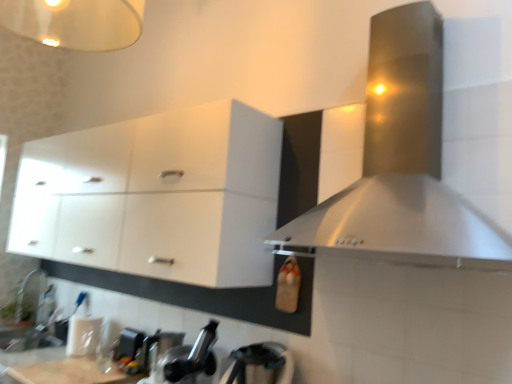
What is the approximate width of white glossy sink at lower left?

The width of white glossy sink at lower left is 13.00 inches.

Locate an element on the screen. This screenshot has height=384, width=512. metallic gray toaster at lower left, the third appliance when ordered from right to left is located at coordinates (x=129, y=343).

You are a GUI agent. You are given a task and a screenshot of the screen. Output one action in this format:
    pyautogui.click(x=<x>, y=<y>)
    Task: Click on the stainless steel range hood at upper right
    
    Given the screenshot: What is the action you would take?
    point(403,164)

Is point (169, 363) farther from viewer compared to point (45, 273)?

That is False.

Measure the distance between black matte faucet at lower center, acting as the second appliance starting from the right, and brushed metal faucet at lower left.

A distance of 5.90 feet exists between black matte faucet at lower center, acting as the second appliance starting from the right, and brushed metal faucet at lower left.

From a real-world perspective, does black matte faucet at lower center, acting as the second appliance starting from the right, stand above brushed metal faucet at lower left?

Yes, from a real-world perspective, black matte faucet at lower center, acting as the second appliance starting from the right, is over brushed metal faucet at lower left

Is black matte faucet at lower center, positioned as the second appliance in front-to-back order, outside of brushed metal faucet at lower left?

Yes, black matte faucet at lower center, positioned as the second appliance in front-to-back order, is located beyond the bounds of brushed metal faucet at lower left.

How much distance is there between white glossy sink at lower left and black matte faucet at lower center, acting as the second appliance starting from the right?

white glossy sink at lower left is 1.47 meters away from black matte faucet at lower center, acting as the second appliance starting from the right.

Locate an element on the screen. The height and width of the screenshot is (384, 512). sink below the black matte faucet at lower center, positioned as the second appliance in front-to-back order (from the image's perspective) is located at coordinates (30, 315).

Does white glossy sink at lower left have a larger size compared to black matte faucet at lower center, positioned as the second appliance in front-to-back order?

Yes.

Does stainless steel range hood at upper right contain brushed metal faucet at lower left?

No, brushed metal faucet at lower left is not a part of stainless steel range hood at upper right.

Identify the location of home appliance above the brushed metal faucet at lower left (from the image's perspective). (403, 164).

Considering the relative sizes of stainless steel range hood at upper right and brushed metal faucet at lower left in the image provided, is stainless steel range hood at upper right wider than brushed metal faucet at lower left?

Indeed, stainless steel range hood at upper right has a greater width compared to brushed metal faucet at lower left.

Which is more to the left, stainless steel range hood at upper right or brushed metal faucet at lower left?

Positioned to the left is brushed metal faucet at lower left.

Which is behind, point (40, 283) or point (439, 134)?

Point (40, 283)

Who is more distant, white glossy sink at lower left or stainless steel range hood at upper right?

white glossy sink at lower left.

Considering the relative sizes of white glossy sink at lower left and stainless steel range hood at upper right in the image provided, is white glossy sink at lower left bigger than stainless steel range hood at upper right?

Incorrect, white glossy sink at lower left is not larger than stainless steel range hood at upper right.

In the image, is metallic gray toaster at lower left, the third appliance when ordered from right to left, on the left side or the right side of black matte faucet at lower center, acting as the second appliance starting from the right?

metallic gray toaster at lower left, the third appliance when ordered from right to left, is to the left of black matte faucet at lower center, acting as the second appliance starting from the right.

Is metallic gray toaster at lower left, placed as the first appliance when sorted from left to right, situated inside black matte faucet at lower center, the second appliance viewed from the back, or outside?

metallic gray toaster at lower left, placed as the first appliance when sorted from left to right, exists outside the volume of black matte faucet at lower center, the second appliance viewed from the back.

Locate an element on the screen. This screenshot has height=384, width=512. appliance that is the 2nd one above the metallic gray toaster at lower left, arranged as the first appliance when viewed from the back (from a real-world perspective) is located at coordinates (188, 359).

From the image's perspective, who appears lower, metallic gray toaster at lower left, placed as the first appliance when sorted from left to right, or black matte faucet at lower center, the second appliance viewed from the back?

metallic gray toaster at lower left, placed as the first appliance when sorted from left to right, appears lower in the image.

Is stainless steel range hood at upper right not near white glossy cabinet at upper left?

They are positioned close to each other.

Which point is more distant from viewer, (360, 217) or (129, 264)?

The point (129, 264) is farther.

From a real-world perspective, is stainless steel range hood at upper right positioned above or below white glossy cabinet at upper left?

Clearly, from a real-world perspective, stainless steel range hood at upper right is above white glossy cabinet at upper left.

You are a GUI agent. You are given a task and a screenshot of the screen. Output one action in this format:
    pyautogui.click(x=<x>, y=<y>)
    Task: Click on the home appliance located above the white glossy cabinet at upper left (from a real-world perspective)
    
    Given the screenshot: What is the action you would take?
    pyautogui.click(x=403, y=164)

From the image's perspective, does white glossy cabinet at upper left appear lower than stainless steel range hood at upper right?

Indeed, from the image's perspective, white glossy cabinet at upper left is shown beneath stainless steel range hood at upper right.

Is white glossy cabinet at upper left aimed at stainless steel range hood at upper right?

No, white glossy cabinet at upper left does not turn towards stainless steel range hood at upper right.

Which of these two, white glossy cabinet at upper left or stainless steel range hood at upper right, is smaller?

stainless steel range hood at upper right.

Can you confirm if white glossy cabinet at upper left is wider than stainless steel range hood at upper right?

No.

This screenshot has height=384, width=512. I want to click on the 2nd appliance to the right of the brushed metal faucet at lower left, counting from the anchor's position, so click(188, 359).

This screenshot has height=384, width=512. Find the location of `sink behind the black matte faucet at lower center, the second appliance viewed from the back`. sink behind the black matte faucet at lower center, the second appliance viewed from the back is located at coordinates (30, 315).

Looking at the image, which one is located closer to metallic gray toaster at lower left, arranged as the first appliance when viewed from the back, brushed metal kettle at lower center, arranged as the 1th appliance when viewed from the right, or black matte faucet at lower center, acting as the second appliance starting from the right?

black matte faucet at lower center, acting as the second appliance starting from the right, is closer to metallic gray toaster at lower left, arranged as the first appliance when viewed from the back.

Considering their positions, is stainless steel range hood at upper right positioned closer to white glossy cabinet at upper left than brushed metal kettle at lower center, arranged as the 1th appliance when viewed from the right?

stainless steel range hood at upper right.

Based on their spatial positions, is stainless steel range hood at upper right or white glossy sink at lower left further from brushed metal kettle at lower center, which is the 3th appliance from back to front?

Based on the image, white glossy sink at lower left appears to be further to brushed metal kettle at lower center, which is the 3th appliance from back to front.

From the picture: When comparing their distances from stainless steel range hood at upper right, does brushed metal faucet at lower left or white glossy cabinet at upper left seem further?

brushed metal faucet at lower left lies further to stainless steel range hood at upper right than the other object.

Looking at the image, which one is located further to metallic gray toaster at lower left, the third appliance in the front-to-back sequence, black matte faucet at lower center, the 2th appliance in the left-to-right sequence, or stainless steel range hood at upper right?

stainless steel range hood at upper right is further to metallic gray toaster at lower left, the third appliance in the front-to-back sequence.

From the image, which object appears to be farther from black matte faucet at lower center, the second appliance viewed from the back, metallic gray toaster at lower left, the third appliance in the front-to-back sequence, or stainless steel range hood at upper right?

stainless steel range hood at upper right is positioned further to the anchor black matte faucet at lower center, the second appliance viewed from the back.

When comparing their distances from stainless steel range hood at upper right, does brushed metal kettle at lower center, which is the 3th appliance from left to right, or white glossy cabinet at upper left seem further?

The object further to stainless steel range hood at upper right is white glossy cabinet at upper left.

Looking at the image, which one is located further to black matte faucet at lower center, positioned as the second appliance in front-to-back order, brushed metal faucet at lower left or metallic gray toaster at lower left, the third appliance in the front-to-back sequence?

brushed metal faucet at lower left is further to black matte faucet at lower center, positioned as the second appliance in front-to-back order.

Where is `cabinetry located between white glossy sink at lower left and black matte faucet at lower center, the 2th appliance in the left-to-right sequence, in the left-right direction`? Image resolution: width=512 pixels, height=384 pixels. cabinetry located between white glossy sink at lower left and black matte faucet at lower center, the 2th appliance in the left-to-right sequence, in the left-right direction is located at coordinates (156, 196).

Image resolution: width=512 pixels, height=384 pixels. What are the coordinates of `appliance between brushed metal faucet at lower left and black matte faucet at lower center, positioned as the second appliance in front-to-back order, from left to right` in the screenshot? It's located at (129, 343).

Where is `sink between white glossy cabinet at upper left and brushed metal faucet at lower left along the z-axis`? The width and height of the screenshot is (512, 384). sink between white glossy cabinet at upper left and brushed metal faucet at lower left along the z-axis is located at coordinates (30, 315).

Where is `cabinetry between white glossy sink at lower left and stainless steel range hood at upper right from left to right`? cabinetry between white glossy sink at lower left and stainless steel range hood at upper right from left to right is located at coordinates (156, 196).